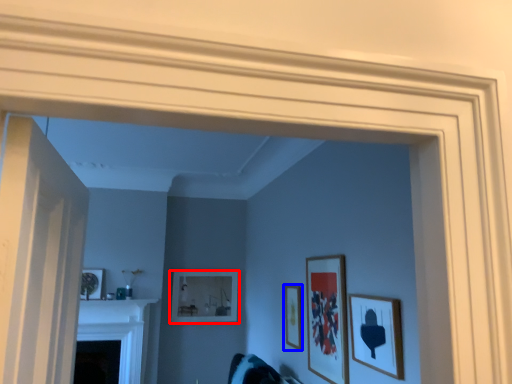
Question: Which object is further to the camera taking this photo, picture frame (highlighted by a red box) or picture frame (highlighted by a blue box)?

Choices:
 (A) picture frame
 (B) picture frame

Answer: (A)